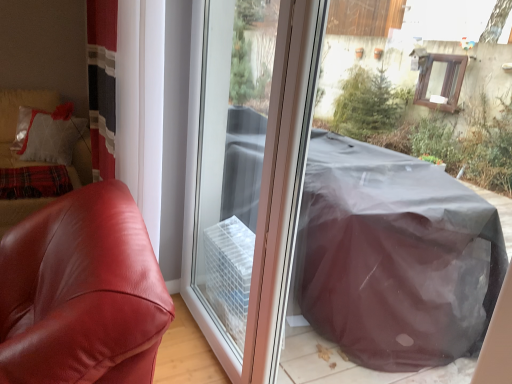
You are a GUI agent. You are given a task and a screenshot of the screen. Output one action in this format:
    pyautogui.click(x=<x>, y=<y>)
    Task: Click on the satin red armchair at left
    The image size is (512, 384).
    Given the screenshot: What is the action you would take?
    pyautogui.click(x=82, y=292)

Locate an element on the screen. Image resolution: width=512 pixels, height=384 pixels. transparent plastic screen door at center is located at coordinates (250, 174).

Are matte leather couch at left and transparent plastic screen door at center making contact?

matte leather couch at left and transparent plastic screen door at center are clearly separated.

From the image's perspective, is matte leather couch at left positioned above or below transparent plastic screen door at center?

matte leather couch at left is situated higher than transparent plastic screen door at center in the image.

Is matte leather couch at left facing away from transparent plastic screen door at center?

matte leather couch at left does not have its back to transparent plastic screen door at center.

Is point (34, 199) less distant than point (198, 257)?

That is False.

Can you see transparent plastic screen door at center touching satin red armchair at left?

They are not placed beside each other.

Locate an element on the screen. This screenshot has width=512, height=384. screen door that is on the right side of satin red armchair at left is located at coordinates (250, 174).

Consider the image. Choose the correct answer: Is transparent plastic screen door at center inside satin red armchair at left or outside it?

transparent plastic screen door at center is not inside satin red armchair at left, it's outside.

From the picture: Between transparent plastic screen door at center and satin red armchair at left, which one has more height?

Standing taller between the two is transparent plastic screen door at center.

Is the surface of transparent plastic screen door at center in direct contact with matte leather couch at left?

No, transparent plastic screen door at center is not touching matte leather couch at left.

How much distance is there between transparent plastic screen door at center and matte leather couch at left?

A distance of 1.72 meters exists between transparent plastic screen door at center and matte leather couch at left.

From a real-world perspective, is transparent plastic screen door at center physically above matte leather couch at left?

Yes, from a real-world perspective, transparent plastic screen door at center is above matte leather couch at left.

Is transparent plastic screen door at center in front of or behind matte leather couch at left in the image?

In the image, transparent plastic screen door at center appears in front of matte leather couch at left.

From the image's perspective, would you say matte leather couch at left is shown under satin red armchair at left?

Actually, matte leather couch at left appears above satin red armchair at left in the image.

How much distance is there between matte leather couch at left and satin red armchair at left?

The distance of matte leather couch at left from satin red armchair at left is 6.61 feet.

Does matte leather couch at left come in front of satin red armchair at left?

No, matte leather couch at left is behind satin red armchair at left.

In the scene shown: From a real-world perspective, which is physically above, matte leather couch at left or satin red armchair at left?

matte leather couch at left is physically above.

Considering the relative positions of satin red armchair at left and transparent plastic screen door at center in the image provided, is satin red armchair at left to the right of transparent plastic screen door at center from the viewer's perspective?

No, satin red armchair at left is not to the right of transparent plastic screen door at center.

From a real-world perspective, which object rests below the other?

satin red armchair at left is physically lower.

Which of these two, satin red armchair at left or matte leather couch at left, is smaller?

satin red armchair at left is smaller.

Based on the photo, considering the relative sizes of satin red armchair at left and matte leather couch at left in the image provided, is satin red armchair at left thinner than matte leather couch at left?

Yes.

Which is closer to the camera, (126,362) or (16,115)?

Positioned in front is point (126,362).

You are a GUI agent. You are given a task and a screenshot of the screen. Output one action in this format:
    pyautogui.click(x=<x>, y=<y>)
    Task: Click on the couch above the transparent plastic screen door at center (from the image's perspective)
    
    Given the screenshot: What is the action you would take?
    pyautogui.click(x=16, y=120)

The width and height of the screenshot is (512, 384). I want to click on screen door that is on the right side of satin red armchair at left, so click(250, 174).

Based on their spatial positions, is matte leather couch at left or satin red armchair at left further from transparent plastic screen door at center?

matte leather couch at left is positioned further to the anchor transparent plastic screen door at center.

From the image, which object appears to be nearer to satin red armchair at left, matte leather couch at left or transparent plastic screen door at center?

transparent plastic screen door at center lies closer to satin red armchair at left than the other object.

Estimate the real-world distances between objects in this image. Which object is closer to matte leather couch at left, transparent plastic screen door at center or satin red armchair at left?

Based on the image, transparent plastic screen door at center appears to be nearer to matte leather couch at left.

From the image, which object appears to be nearer to satin red armchair at left, transparent plastic screen door at center or matte leather couch at left?

transparent plastic screen door at center is closer to satin red armchair at left.

Considering their positions, is satin red armchair at left positioned further to transparent plastic screen door at center than matte leather couch at left?

matte leather couch at left lies further to transparent plastic screen door at center than the other object.

Which object lies nearer to the anchor point matte leather couch at left, satin red armchair at left or transparent plastic screen door at center?

Based on the image, transparent plastic screen door at center appears to be nearer to matte leather couch at left.

Locate an element on the screen. screen door between satin red armchair at left and matte leather couch at left from front to back is located at coordinates (250, 174).